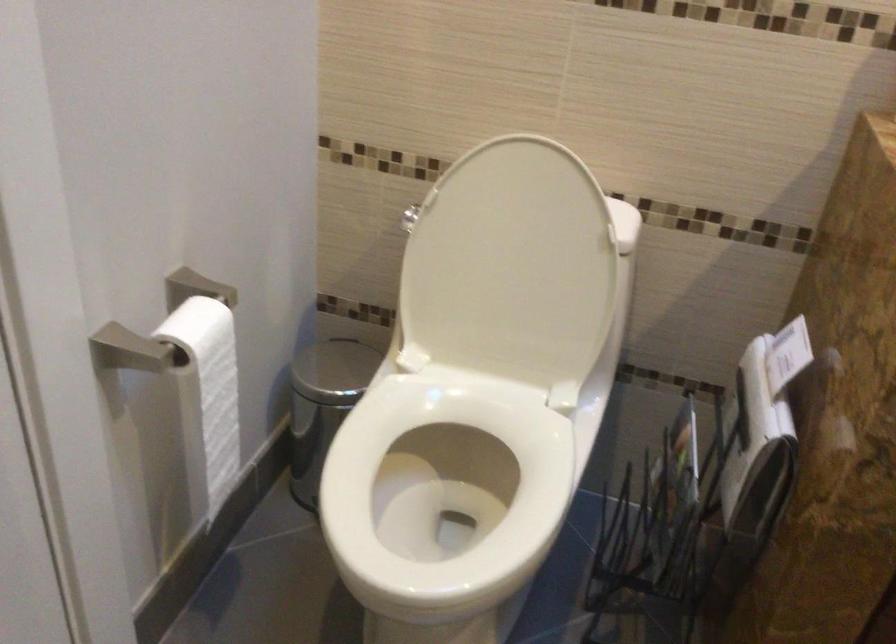
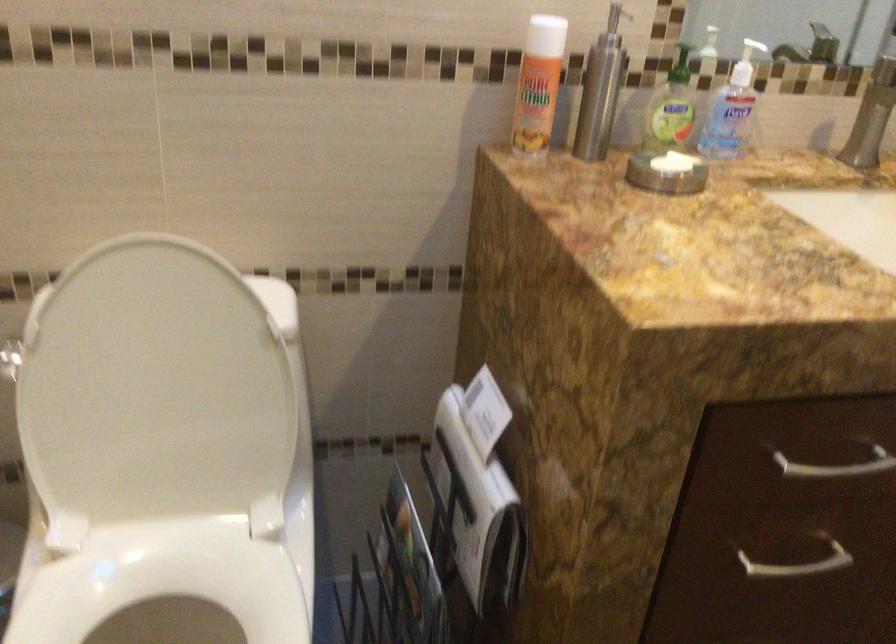
Question: The first image is from the beginning of the video and the second image is from the end. How did the camera likely rotate when shooting the video?

Choices:
 (A) Left
 (B) Right
 (C) Up
 (D) Down

Answer: (B)